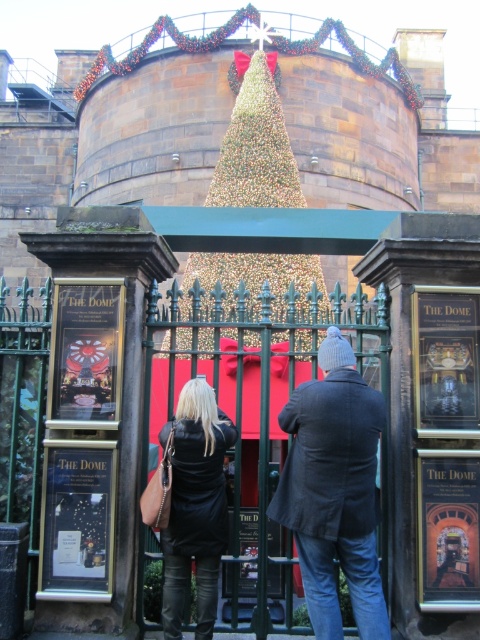
Can you confirm if dark gray woolen coat at center is positioned to the left of black leather jacket at center?

Incorrect, dark gray woolen coat at center is not on the left side of black leather jacket at center.

Does dark gray woolen coat at center have a lesser height compared to black leather jacket at center?

Yes.

Is point (303, 412) positioned in front of point (177, 472)?

Yes, it is in front of point (177, 472).

You are a GUI agent. You are given a task and a screenshot of the screen. Output one action in this format:
    pyautogui.click(x=<x>, y=<y>)
    Task: Click on the dark gray woolen coat at center
    The image size is (480, 640).
    Given the screenshot: What is the action you would take?
    pyautogui.click(x=334, y=490)

Which is more to the right, gold glittering tree at center or black leather jacket at center?

From the viewer's perspective, gold glittering tree at center appears more on the right side.

Is point (250, 100) positioned in front of point (195, 625)?

No, it is not.

Where is `gold glittering tree at center`? gold glittering tree at center is located at coordinates (255, 145).

Where is `gold glittering tree at center`? gold glittering tree at center is located at coordinates (255, 145).

Between dark gray woolen coat at center and gold glittering tree at center, which one has less height?

With less height is dark gray woolen coat at center.

Measure the distance between dark gray woolen coat at center and gold glittering tree at center.

The distance of dark gray woolen coat at center from gold glittering tree at center is 94.71 feet.

What do you see at coordinates (334, 490) in the screenshot? This screenshot has height=640, width=480. I see `dark gray woolen coat at center` at bounding box center [334, 490].

In order to click on dark gray woolen coat at center in this screenshot , I will do `click(334, 490)`.